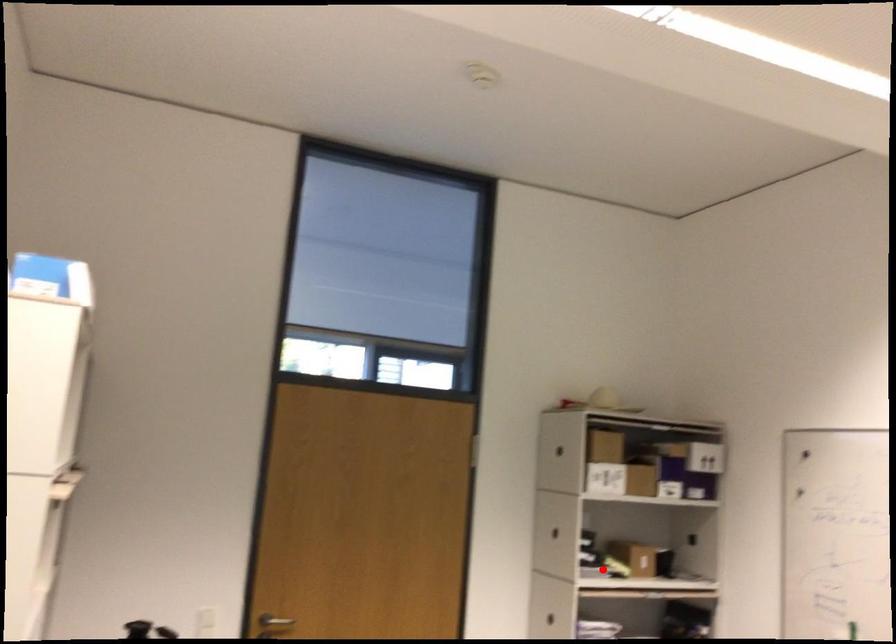
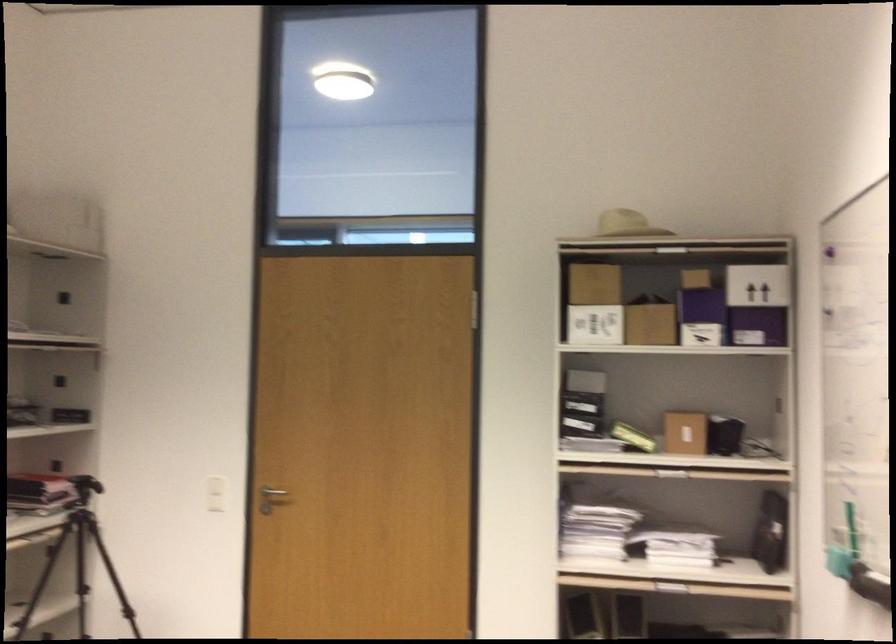
Find the pixel in the second image that matches the highlighted location in the first image.

(633, 437)